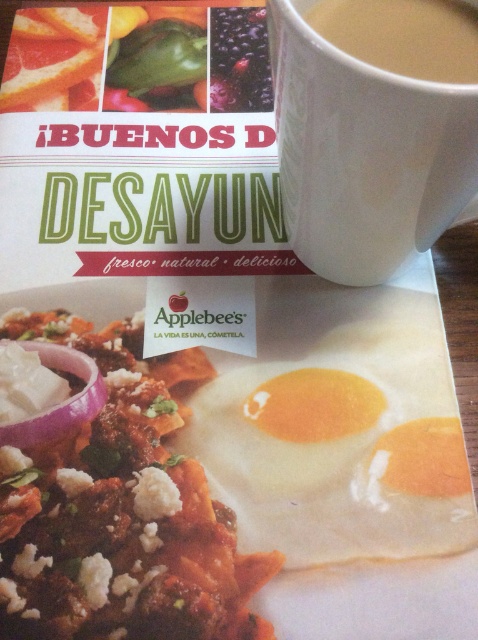
You are a customer at Applebee and want to grab the white ceramic mug at upper center to pour coffee. Is the purple translucent onion at lower left blocking your way?

The white ceramic mug at upper center is in front of the purple translucent onion at lower left, so the onion is not blocking the way to the mug.

You are a customer looking at the Applebee menu and see the white ceramic mug at upper center and the white fried egg at center. Which object is located to the right of the other?

The white ceramic mug at upper center is positioned on the right side of white fried egg at center.